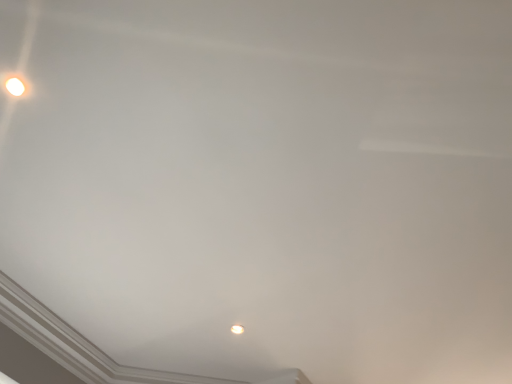
Identify the location of matte white lamp at upper left, acting as the second lamp starting from the right. (15, 86).

This screenshot has height=384, width=512. Describe the element at coordinates (15, 86) in the screenshot. I see `matte white lamp at upper left, which ranks as the first lamp in left-to-right order` at that location.

This screenshot has height=384, width=512. In order to click on matte white lamp at center, the second lamp from the front in this screenshot , I will do `click(237, 329)`.

The image size is (512, 384). What do you see at coordinates (237, 329) in the screenshot?
I see `matte white lamp at center, the first lamp viewed from the back` at bounding box center [237, 329].

Measure the distance between point [238,327] and camera.

They are 6.93 feet apart.

Identify the location of matte white lamp at upper left, which ranks as the first lamp in left-to-right order. (15, 86).

Is matte white lamp at center, positioned as the second lamp in top-to-bottom order, to the left of matte white lamp at upper left, acting as the second lamp starting from the right, from the viewer's perspective?

No, matte white lamp at center, positioned as the second lamp in top-to-bottom order, is not to the left of matte white lamp at upper left, acting as the second lamp starting from the right.

Is matte white lamp at center, arranged as the first lamp when viewed from the right, closer to the viewer compared to matte white lamp at upper left, the first lamp in the top-to-bottom sequence?

No, the depth of matte white lamp at center, arranged as the first lamp when viewed from the right, is greater than that of matte white lamp at upper left, the first lamp in the top-to-bottom sequence.

Does point (242, 329) appear closer or farther from the camera than point (10, 92)?

Point (242, 329) appears to be farther away from the viewer than point (10, 92).

From the image's perspective, is matte white lamp at center, which is the second lamp in left-to-right order, under matte white lamp at upper left, which is the 2th lamp in bottom-to-top order?

Yes, from the image's perspective, matte white lamp at center, which is the second lamp in left-to-right order, is beneath matte white lamp at upper left, which is the 2th lamp in bottom-to-top order.

From a real-world perspective, does matte white lamp at center, the second lamp from the front, sit lower than matte white lamp at upper left, positioned as the first lamp in front-to-back order?

No, from a real-world perspective, matte white lamp at center, the second lamp from the front, is not under matte white lamp at upper left, positioned as the first lamp in front-to-back order.

Considering the sizes of objects matte white lamp at center, the second lamp from the front, and matte white lamp at upper left, acting as the second lamp starting from the right, in the image provided, who is thinner, matte white lamp at center, the second lamp from the front, or matte white lamp at upper left, acting as the second lamp starting from the right,?

matte white lamp at upper left, acting as the second lamp starting from the right, is thinner.

Who is shorter, matte white lamp at center, the first lamp viewed from the back, or matte white lamp at upper left, which is the second lamp from back to front?

matte white lamp at center, the first lamp viewed from the back, is shorter.

Considering the sizes of objects matte white lamp at center, arranged as the first lamp when viewed from the right, and matte white lamp at upper left, acting as the second lamp starting from the right, in the image provided, who is bigger, matte white lamp at center, arranged as the first lamp when viewed from the right, or matte white lamp at upper left, acting as the second lamp starting from the right,?

matte white lamp at upper left, acting as the second lamp starting from the right, is bigger.

Do you think matte white lamp at center, arranged as the first lamp when viewed from the right, is within matte white lamp at upper left, the first lamp in the top-to-bottom sequence, or outside of it?

matte white lamp at center, arranged as the first lamp when viewed from the right, is located beyond the bounds of matte white lamp at upper left, the first lamp in the top-to-bottom sequence.

Is matte white lamp at center, the second lamp from the front, facing away from matte white lamp at upper left, the first lamp in the top-to-bottom sequence?

No.

How far apart are matte white lamp at center, the second lamp from the front, and matte white lamp at upper left, which is the second lamp from back to front?

matte white lamp at center, the second lamp from the front, and matte white lamp at upper left, which is the second lamp from back to front, are 4.69 feet apart from each other.

Locate an element on the screen. lamp that is on the right side of matte white lamp at upper left, which ranks as the first lamp in left-to-right order is located at coordinates (237, 329).

Can you confirm if matte white lamp at upper left, which is the 2th lamp in bottom-to-top order, is positioned to the right of matte white lamp at center, the first lamp viewed from the back?

No, matte white lamp at upper left, which is the 2th lamp in bottom-to-top order, is not to the right of matte white lamp at center, the first lamp viewed from the back.

Does matte white lamp at upper left, acting as the second lamp starting from the right, lie behind matte white lamp at center, which is the second lamp in left-to-right order?

No, matte white lamp at upper left, acting as the second lamp starting from the right, is closer to the camera.

Is point (14, 88) closer to viewer compared to point (240, 329)?

Yes, it is.

From the image's perspective, between matte white lamp at upper left, which is the second lamp from back to front, and matte white lamp at center, the second lamp from the front, who is located below?

From the image's view, matte white lamp at center, the second lamp from the front, is below.

From a real-world perspective, relative to matte white lamp at center, the second lamp from the front, is matte white lamp at upper left, which is the second lamp from back to front, vertically above or below?

matte white lamp at upper left, which is the second lamp from back to front, is below matte white lamp at center, the second lamp from the front.

Between matte white lamp at upper left, positioned as the first lamp in front-to-back order, and matte white lamp at center, the first lamp viewed from the back, which one has larger width?

Wider between the two is matte white lamp at center, the first lamp viewed from the back.

From their relative heights in the image, would you say matte white lamp at upper left, which is the second lamp from back to front, is taller or shorter than matte white lamp at center, arranged as the first lamp when viewed from the right?

Considering their sizes, matte white lamp at upper left, which is the second lamp from back to front, has more height than matte white lamp at center, arranged as the first lamp when viewed from the right.

Looking at the image, does matte white lamp at upper left, which ranks as the first lamp in left-to-right order, seem bigger or smaller compared to matte white lamp at center, the first lamp viewed from the back?

Clearly, matte white lamp at upper left, which ranks as the first lamp in left-to-right order, is larger in size than matte white lamp at center, the first lamp viewed from the back.

Is matte white lamp at center, arranged as the first lamp when viewed from the right, a part of matte white lamp at upper left, positioned as the first lamp in front-to-back order?

No, matte white lamp at center, arranged as the first lamp when viewed from the right, is not inside matte white lamp at upper left, positioned as the first lamp in front-to-back order.

Can you see matte white lamp at upper left, which is the second lamp from back to front, touching matte white lamp at center, positioned as the second lamp in top-to-bottom order?

matte white lamp at upper left, which is the second lamp from back to front, is not next to matte white lamp at center, positioned as the second lamp in top-to-bottom order, and they're not touching.

Is matte white lamp at upper left, which ranks as the first lamp in left-to-right order, facing away from matte white lamp at center, the second lamp from the front?

matte white lamp at upper left, which ranks as the first lamp in left-to-right order, does not have its back to matte white lamp at center, the second lamp from the front.

How distant is matte white lamp at upper left, which is the second lamp from back to front, from matte white lamp at center, the second lamp from the front?

matte white lamp at upper left, which is the second lamp from back to front, is 1.43 meters from matte white lamp at center, the second lamp from the front.

The height and width of the screenshot is (384, 512). What are the coordinates of `lamp that appears behind the matte white lamp at upper left, which is the 2th lamp in bottom-to-top order` in the screenshot? It's located at (237, 329).

This screenshot has height=384, width=512. Identify the location of lamp in front of the matte white lamp at center, positioned as the second lamp in top-to-bottom order. (15, 86).

Locate an element on the screen. lamp on the left side of matte white lamp at center, which is the second lamp in left-to-right order is located at coordinates (x=15, y=86).